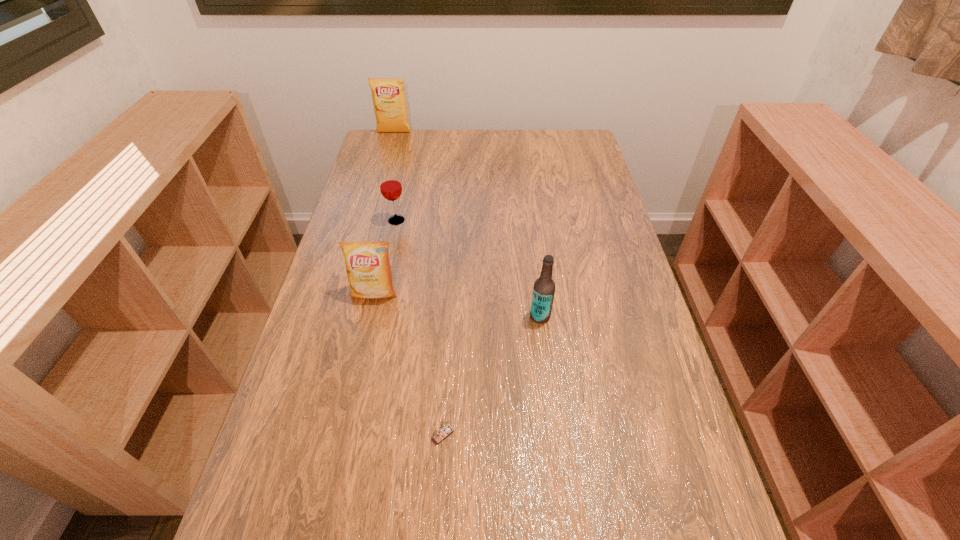
In the image, there is a desktop. Identify the location of vacant space at the left edge. The width and height of the screenshot is (960, 540). (345, 219).

Identify the location of free space at the right edge. (602, 275).

Where is `free region at the far left corner of the desktop`? free region at the far left corner of the desktop is located at coordinates (374, 147).

This screenshot has width=960, height=540. Find the location of `free point between the matchbox and the farther crisp (potato chip)`. free point between the matchbox and the farther crisp (potato chip) is located at coordinates (419, 284).

This screenshot has height=540, width=960. What are the coordinates of `empty space that is in between the shorter crisp (potato chip) and the taller crisp (potato chip)` in the screenshot? It's located at (384, 213).

The width and height of the screenshot is (960, 540). What are the coordinates of `unoccupied position between the shorter crisp (potato chip) and the farthest object` in the screenshot? It's located at (384, 213).

The image size is (960, 540). Identify the location of free point between the taller crisp (potato chip) and the rightmost object. (467, 224).

Identify the location of vacant area between the farthest object and the nearer crisp (potato chip). (384, 213).

Locate an element on the screen. Image resolution: width=960 pixels, height=540 pixels. free point between the farther crisp (potato chip) and the shortest object is located at coordinates (419, 284).

Where is `free spot between the shorter crisp (potato chip) and the farther crisp (potato chip)`? This screenshot has height=540, width=960. free spot between the shorter crisp (potato chip) and the farther crisp (potato chip) is located at coordinates tap(384, 213).